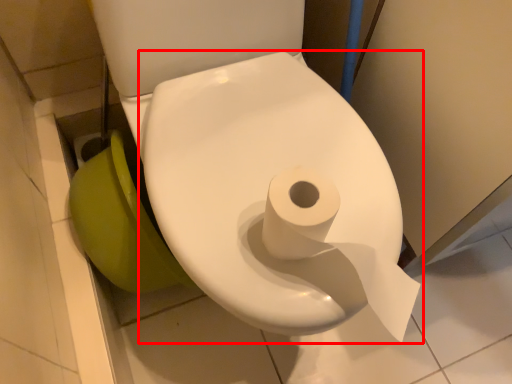
Question: From the image's perspective, where is toilet (annotated by the red box) located in relation to toilet bowl in the image?

Choices:
 (A) above
 (B) below

Answer: (A)